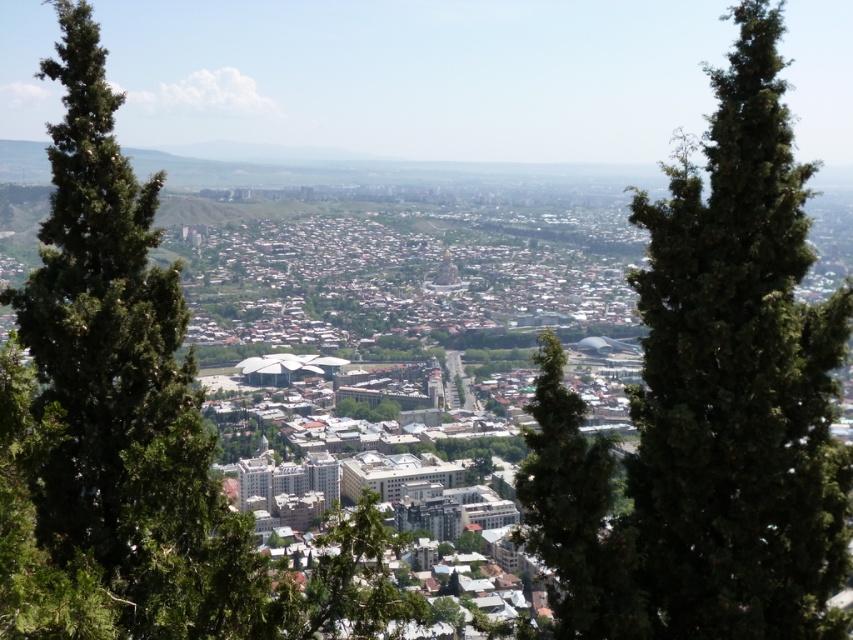
You are a drone operator trying to capture a photo of the two points in the urban landscape image. The first point is at coordinates point (799, 424) and the second is at point (251, 636). Which point is closer to your drone when it is positioned at the camera location?

Point (251, 636) is closer to the drone since it is nearer to the camera than point (799, 424), which is further away.

Based on the photo, you are a drone operator flying a drone over the urban landscape. You notice two trees in the foreground. Which tree, the green textured tree at center or the green leafy tree at left, is positioned higher in the image?

The green textured tree at center is positioned higher in the image than the green leafy tree at left.